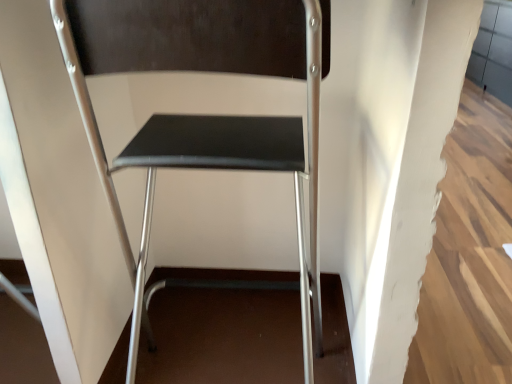
Measure the distance between black leather chair at center and camera.

53.34 centimeters.

What are the coordinates of `black leather chair at center` in the screenshot? It's located at (205, 115).

Image resolution: width=512 pixels, height=384 pixels. What do you see at coordinates (205, 115) in the screenshot?
I see `black leather chair at center` at bounding box center [205, 115].

Find the location of a particular element. Image resolution: width=512 pixels, height=384 pixels. black leather chair at center is located at coordinates (205, 115).